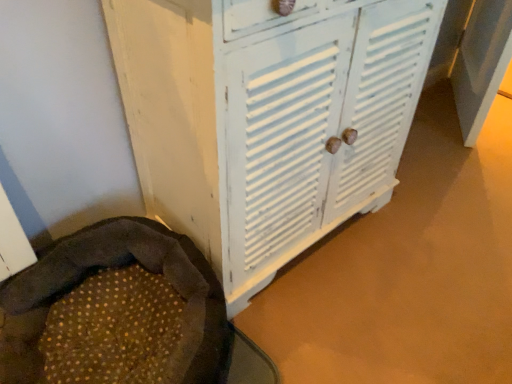
Image resolution: width=512 pixels, height=384 pixels. What do you see at coordinates (115, 311) in the screenshot?
I see `brown textured fabric bean bag chair at lower left` at bounding box center [115, 311].

This screenshot has height=384, width=512. In order to click on brown textured fabric bean bag chair at lower left in this screenshot , I will do `click(115, 311)`.

Measure the distance between white painted wood cupboard at center and camera.

The depth of white painted wood cupboard at center is 27.23 inches.

Describe the element at coordinates (269, 119) in the screenshot. The image size is (512, 384). I see `white painted wood cupboard at center` at that location.

Find the location of a particular element. This screenshot has width=512, height=384. white painted wood cupboard at center is located at coordinates (269, 119).

Locate an element on the screen. brown textured fabric bean bag chair at lower left is located at coordinates (115, 311).

Which object is positioned more to the left, white painted wood cupboard at center or brown textured fabric bean bag chair at lower left?

Positioned to the left is brown textured fabric bean bag chair at lower left.

Considering the positions of objects white painted wood cupboard at center and brown textured fabric bean bag chair at lower left in the image provided, who is behind, white painted wood cupboard at center or brown textured fabric bean bag chair at lower left?

brown textured fabric bean bag chair at lower left.

Is point (297, 71) in front of point (147, 336)?

That is True.

From the image's perspective, is white painted wood cupboard at center beneath brown textured fabric bean bag chair at lower left?

Actually, white painted wood cupboard at center appears above brown textured fabric bean bag chair at lower left in the image.

From a real-world perspective, which is physically above, white painted wood cupboard at center or brown textured fabric bean bag chair at lower left?

white painted wood cupboard at center.

Does white painted wood cupboard at center have a greater width compared to brown textured fabric bean bag chair at lower left?

Incorrect, the width of white painted wood cupboard at center does not surpass that of brown textured fabric bean bag chair at lower left.

Which of these two, white painted wood cupboard at center or brown textured fabric bean bag chair at lower left, stands taller?

With more height is white painted wood cupboard at center.

Considering the sizes of objects white painted wood cupboard at center and brown textured fabric bean bag chair at lower left in the image provided, who is smaller, white painted wood cupboard at center or brown textured fabric bean bag chair at lower left?

brown textured fabric bean bag chair at lower left is smaller.

Is white painted wood cupboard at center spatially inside brown textured fabric bean bag chair at lower left, or outside of it?

white painted wood cupboard at center is spatially situated outside brown textured fabric bean bag chair at lower left.

Does white painted wood cupboard at center touch brown textured fabric bean bag chair at lower left?

No, white painted wood cupboard at center is not beside brown textured fabric bean bag chair at lower left.

Is white painted wood cupboard at center looking in the opposite direction of brown textured fabric bean bag chair at lower left?

No, brown textured fabric bean bag chair at lower left is not at the back of white painted wood cupboard at center.

How much distance is there between white painted wood cupboard at center and brown textured fabric bean bag chair at lower left?

A distance of 15.07 inches exists between white painted wood cupboard at center and brown textured fabric bean bag chair at lower left.

You are a GUI agent. You are given a task and a screenshot of the screen. Output one action in this format:
    pyautogui.click(x=<x>, y=<y>)
    Task: Click on the bean bag chair on the left side of white painted wood cupboard at center
    The width and height of the screenshot is (512, 384).
    Given the screenshot: What is the action you would take?
    pyautogui.click(x=115, y=311)

Considering the positions of objects brown textured fabric bean bag chair at lower left and white painted wood cupboard at center in the image provided, who is more to the right, brown textured fabric bean bag chair at lower left or white painted wood cupboard at center?

white painted wood cupboard at center.

Which object is closer to the camera, brown textured fabric bean bag chair at lower left or white painted wood cupboard at center?

white painted wood cupboard at center.

Considering the positions of point (79, 294) and point (190, 141), is point (79, 294) closer or farther from the camera than point (190, 141)?

Point (79, 294) is farther from the camera than point (190, 141).

From the image's perspective, would you say brown textured fabric bean bag chair at lower left is positioned over white painted wood cupboard at center?

No, from the image's perspective, brown textured fabric bean bag chair at lower left is not on top of white painted wood cupboard at center.

From a real-world perspective, between brown textured fabric bean bag chair at lower left and white painted wood cupboard at center, who is vertically higher?

white painted wood cupboard at center is physically above.

Considering the sizes of objects brown textured fabric bean bag chair at lower left and white painted wood cupboard at center in the image provided, who is thinner, brown textured fabric bean bag chair at lower left or white painted wood cupboard at center?

white painted wood cupboard at center is thinner.

Who is shorter, brown textured fabric bean bag chair at lower left or white painted wood cupboard at center?

Standing shorter between the two is brown textured fabric bean bag chair at lower left.

Considering the sizes of objects brown textured fabric bean bag chair at lower left and white painted wood cupboard at center in the image provided, who is smaller, brown textured fabric bean bag chair at lower left or white painted wood cupboard at center?

Smaller between the two is brown textured fabric bean bag chair at lower left.

Based on the photo, is brown textured fabric bean bag chair at lower left inside or outside of white painted wood cupboard at center?

brown textured fabric bean bag chair at lower left exists outside the volume of white painted wood cupboard at center.

From the picture: Is there a large distance between brown textured fabric bean bag chair at lower left and white painted wood cupboard at center?

brown textured fabric bean bag chair at lower left is actually quite close to white painted wood cupboard at center.

Is brown textured fabric bean bag chair at lower left facing away from white painted wood cupboard at center?

No.

How far apart are brown textured fabric bean bag chair at lower left and white painted wood cupboard at center?

brown textured fabric bean bag chair at lower left is 38.28 centimeters away from white painted wood cupboard at center.

Where is `bean bag chair below the white painted wood cupboard at center (from the image's perspective)`? Image resolution: width=512 pixels, height=384 pixels. bean bag chair below the white painted wood cupboard at center (from the image's perspective) is located at coordinates (115, 311).

At what (x,y) coordinates should I click in order to perform the action: click on bean bag chair that appears behind the white painted wood cupboard at center. Please return your answer as a coordinate pair (x, y). The image size is (512, 384). Looking at the image, I should click on (115, 311).

Where is `bean bag chair on the left of the white painted wood cupboard at center`? The height and width of the screenshot is (384, 512). bean bag chair on the left of the white painted wood cupboard at center is located at coordinates (115, 311).